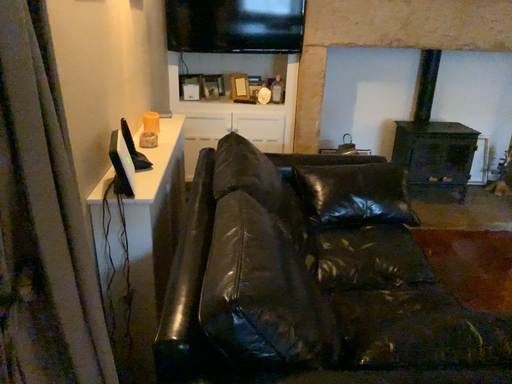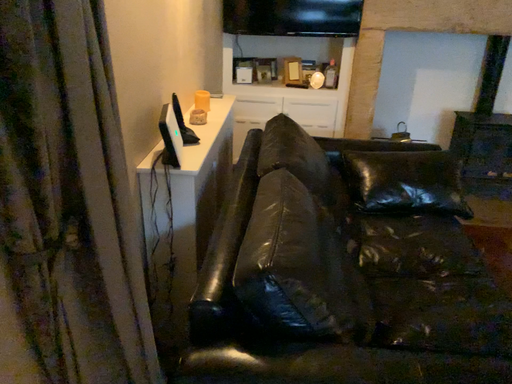
Question: How did the camera likely rotate when shooting the video?

Choices:
 (A) rotated left
 (B) rotated right

Answer: (A)